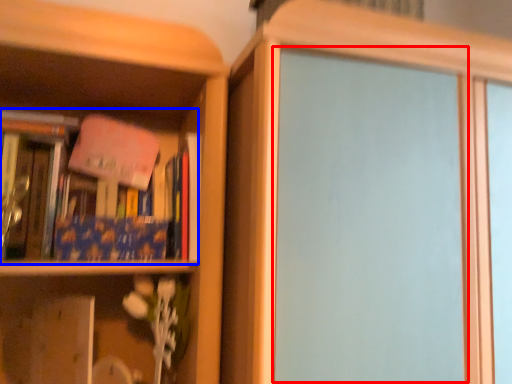
Question: Which object is further to the camera taking this photo, screen door (highlighted by a red box) or book (highlighted by a blue box)?

Choices:
 (A) screen door
 (B) book

Answer: (B)